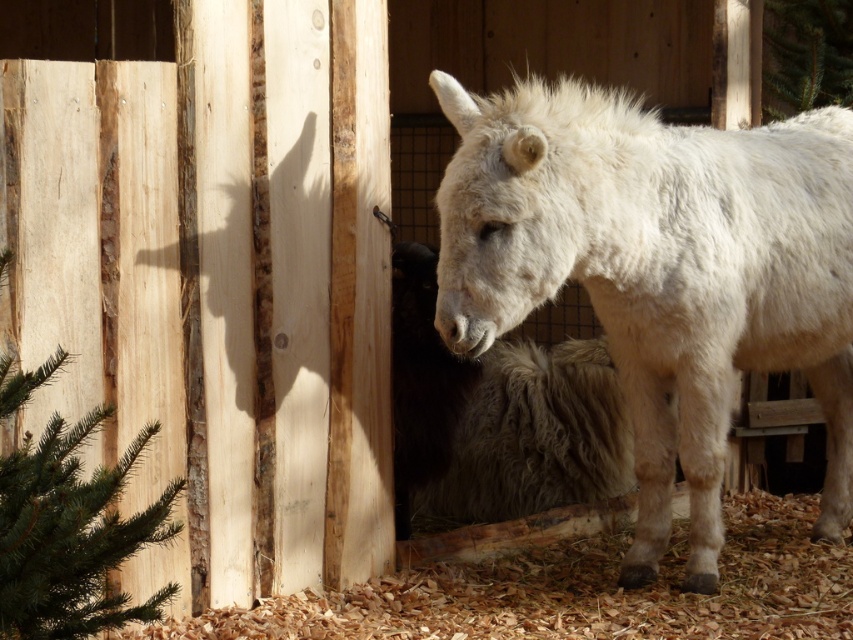
Which is in front, point (726, 225) or point (555, 410)?

Point (726, 225) is in front.

Is point (718, 195) behind point (407, 260)?

No, it is not.

Where is `white woolen donkey at center`? white woolen donkey at center is located at coordinates (659, 273).